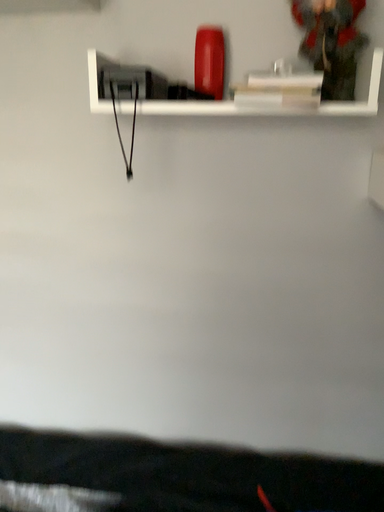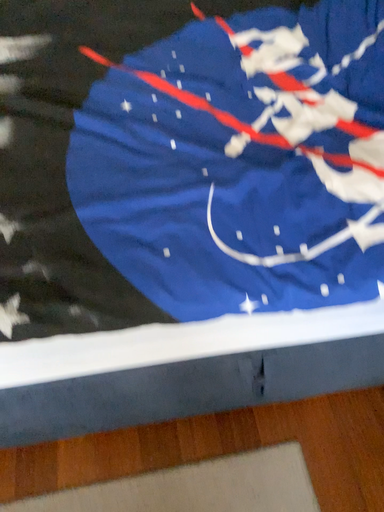
Question: Which way did the camera rotate in the video?

Choices:
 (A) rotated right
 (B) rotated left

Answer: (A)